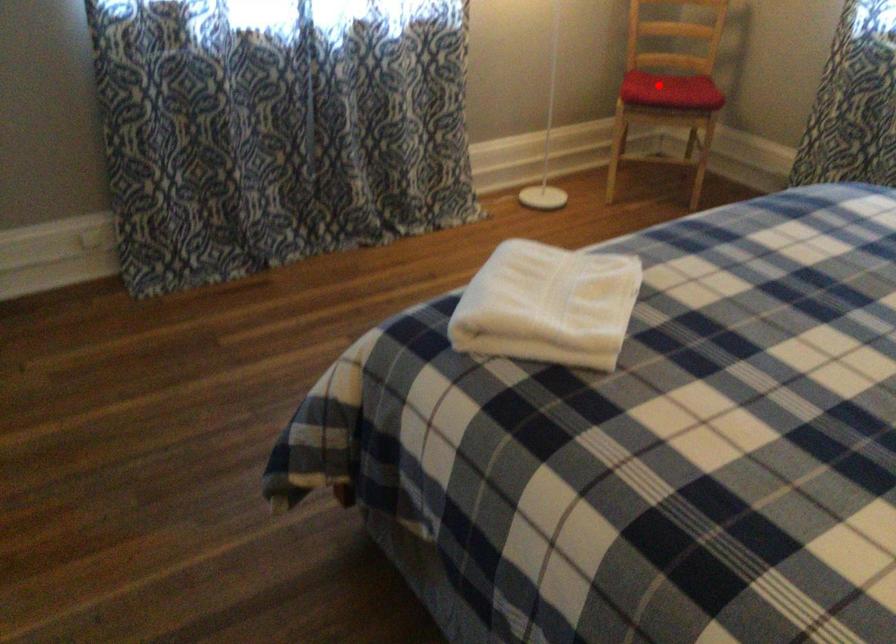
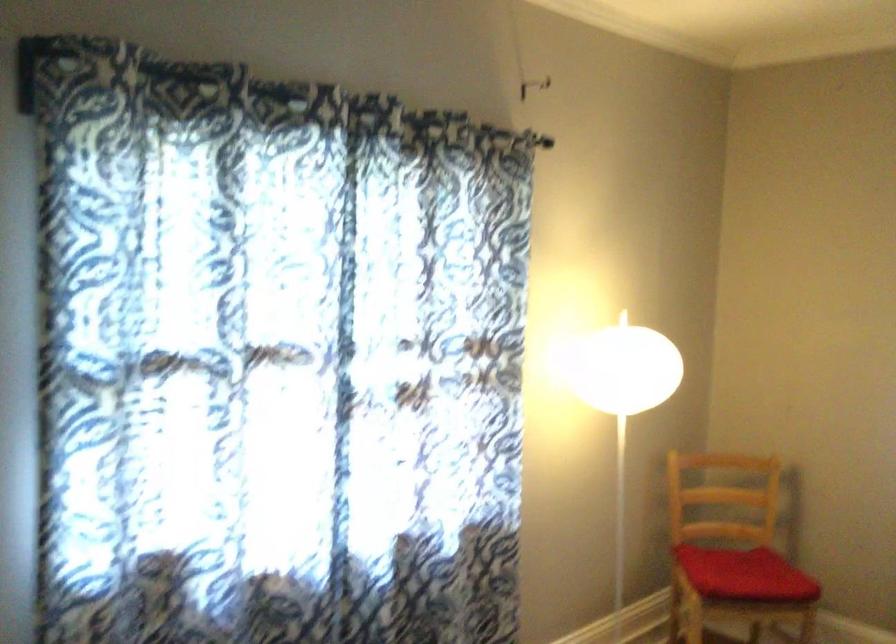
Find the pixel in the second image that matches the highlighted location in the first image.

(745, 574)